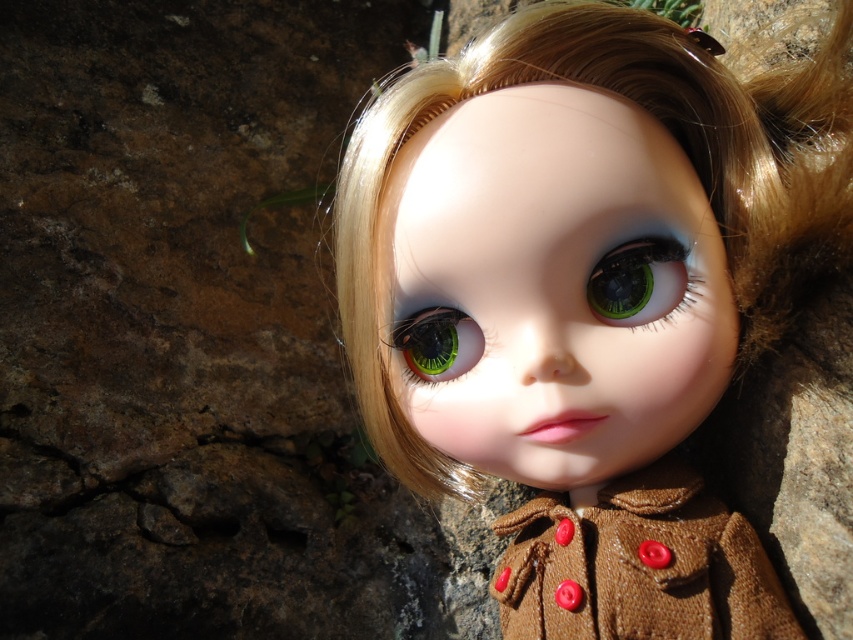
Question: Which point is farther to the camera?

Choices:
 (A) (677, 628)
 (B) (397, 339)
 (C) (717, 125)
 (D) (648, 266)

Answer: (B)

Question: In this image, where is brown textured coat at center located relative to green glossy eye at center?

Choices:
 (A) below
 (B) above

Answer: (A)

Question: Which point is farther to the camera?

Choices:
 (A) green glossy eye at center
 (B) brown textured coat at center
 (C) green matte eye at center
 (D) matte brown coat at center

Answer: (A)

Question: Which object appears closest to the camera in this image?

Choices:
 (A) green matte eye at center
 (B) matte brown coat at center

Answer: (B)

Question: Does brown textured coat at center lie in front of green glossy eye at center?

Choices:
 (A) yes
 (B) no

Answer: (A)

Question: Is the position of green matte eye at center more distant than that of green glossy eye at center?

Choices:
 (A) no
 (B) yes

Answer: (A)